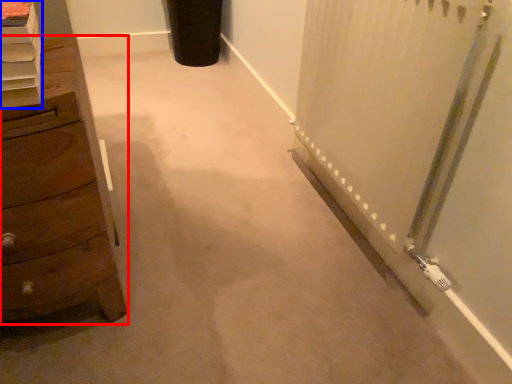
Question: Which of the following is the farthest to the observer, chest of drawers (highlighted by a red box) or shelf (highlighted by a blue box)?

Choices:
 (A) chest of drawers
 (B) shelf

Answer: (A)